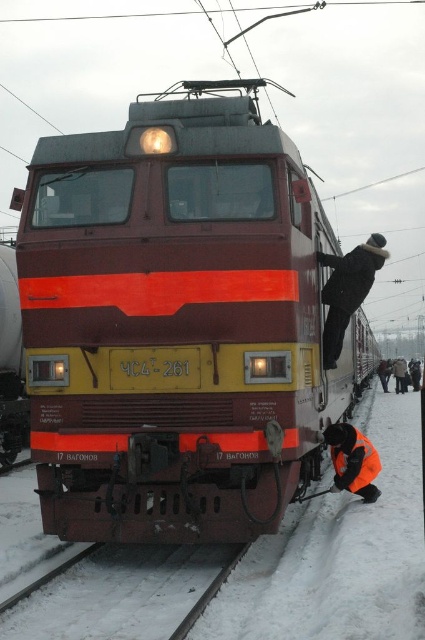
Is point (68, 244) closer to camera compared to point (329, 424)?

Yes.

Measure the distance between maroon glossy train at center and camera.

maroon glossy train at center is 6.18 meters from camera.

Image resolution: width=425 pixels, height=640 pixels. Identify the location of maroon glossy train at center. (178, 323).

Is black fuzzy hat at upper center below orange reflective safety vest at lower center?

Incorrect, black fuzzy hat at upper center is not positioned below orange reflective safety vest at lower center.

Can you confirm if black fuzzy hat at upper center is positioned to the left of orange reflective safety vest at lower center?

No, black fuzzy hat at upper center is not to the left of orange reflective safety vest at lower center.

You are a GUI agent. You are given a task and a screenshot of the screen. Output one action in this format:
    pyautogui.click(x=<x>, y=<y>)
    Task: Click on the black fuzzy hat at upper center
    
    Given the screenshot: What is the action you would take?
    pyautogui.click(x=348, y=289)

Find the location of a particular element. Image resolution: width=425 pixels, height=640 pixels. black fuzzy hat at upper center is located at coordinates (348, 289).

Can you confirm if maroon glossy train at center is positioned below black fuzzy hat at upper center?

No, maroon glossy train at center is not below black fuzzy hat at upper center.

What do you see at coordinates (178, 323) in the screenshot? I see `maroon glossy train at center` at bounding box center [178, 323].

You are a GUI agent. You are given a task and a screenshot of the screen. Output one action in this format:
    pyautogui.click(x=<x>, y=<y>)
    Task: Click on the maroon glossy train at center
    Image resolution: width=425 pixels, height=640 pixels.
    Given the screenshot: What is the action you would take?
    pyautogui.click(x=178, y=323)

What are the coordinates of `maroon glossy train at center` in the screenshot? It's located at (178, 323).